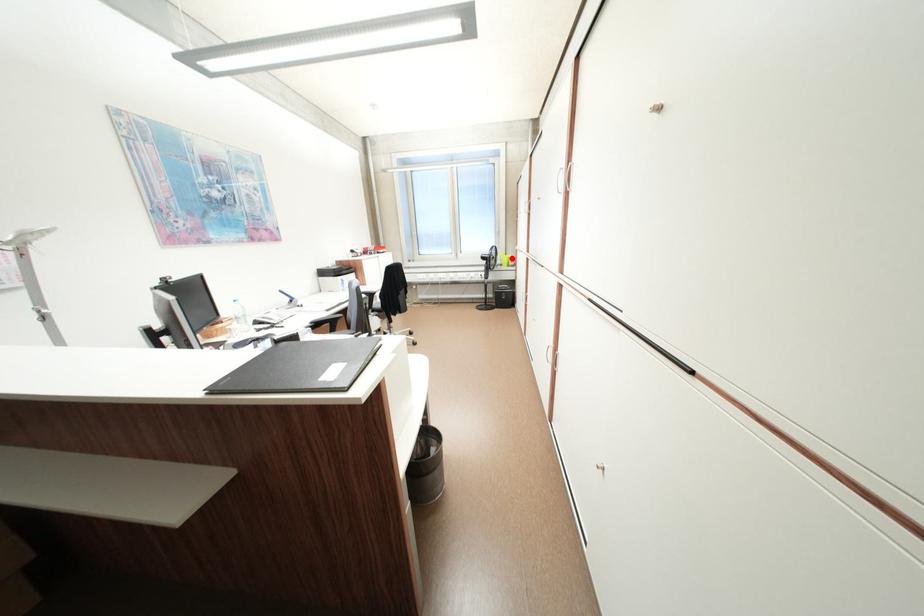
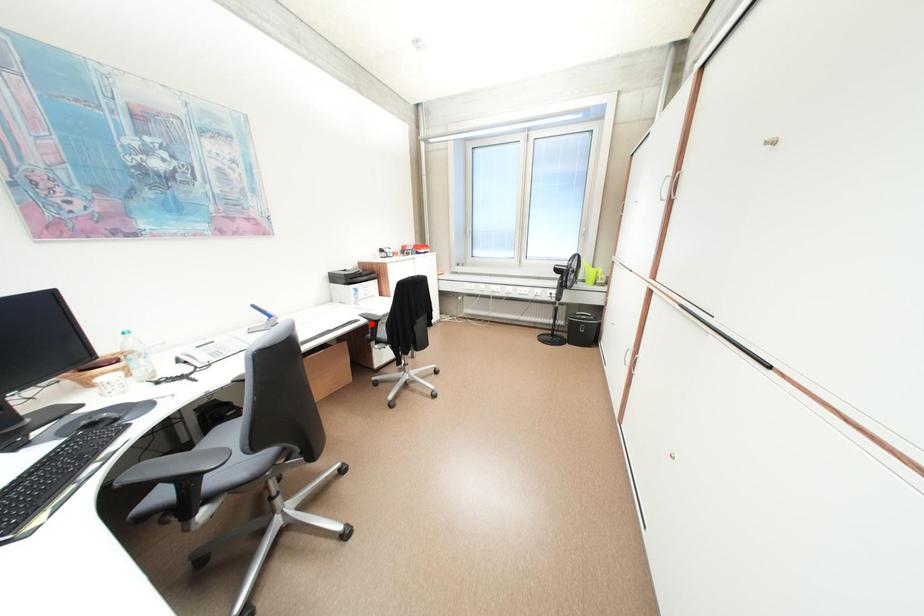
I am providing you with two images of the same scene from different viewpoints. A red point is marked on the first image and another point is marked on the second image. Is the red point in image1 aligned with the point shown in image2?

No